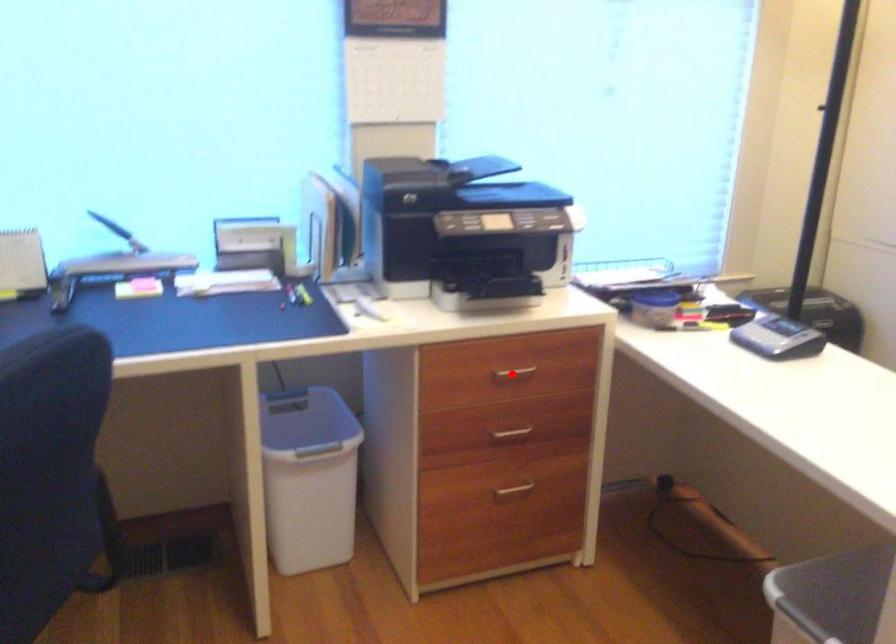
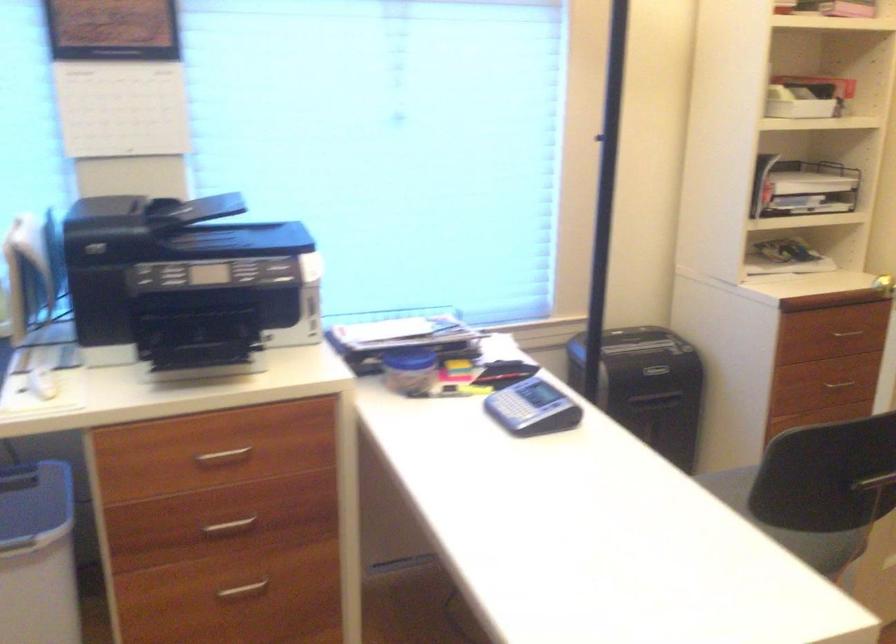
Find the pixel in the second image that matches the highlighted location in the first image.

(222, 457)